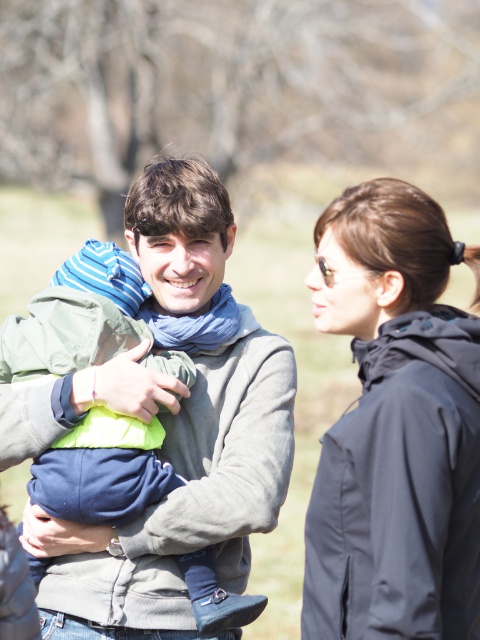
Question: Can you confirm if black matte jacket at right is wider than gray fleece sweater at center?

Choices:
 (A) no
 (B) yes

Answer: (A)

Question: Can you confirm if black matte jacket at right is positioned to the left of gray fleece sweater at center?

Choices:
 (A) no
 (B) yes

Answer: (A)

Question: Is black matte jacket at right positioned behind gray fleece sweater at center?

Choices:
 (A) no
 (B) yes

Answer: (A)